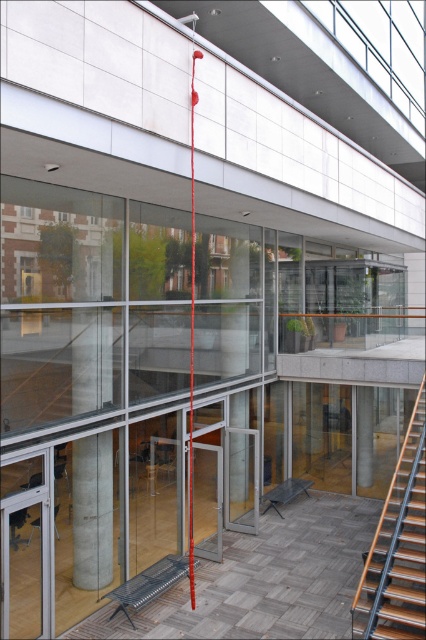
You are standing in the courtyard and want to move from the wooden at right to the metallic red balustrade at lower center. Which direction should you move to reach it?

You should move to the left to reach the metallic red balustrade at lower center because the wooden at right is located to its right side.

In the scene shown: You are planning to place a rectangular bench that is 2 meters wide in the courtyard. The wooden at right and the metallic red balustrade at lower center are in the way. Which object might you need to move or adjust to accommodate the bench?

The wooden at right has a larger width than the metallic red balustrade at lower center. Since the bench is 2 meters wide, you should check the width of the wooden at right to see if there is enough space. If the wooden at right is wider than 2 meters, you might need to move or adjust it to accommodate the bench.